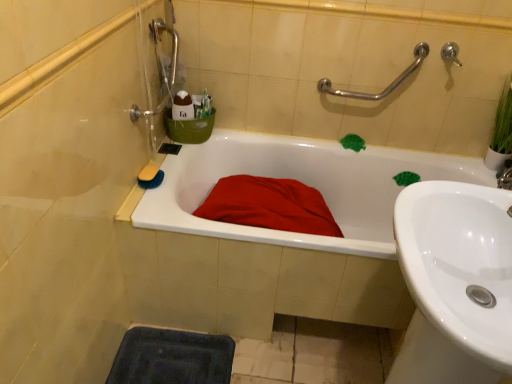
Question: Is yellow sponge at upper left outside dark blue rubber bath mat at lower left?

Choices:
 (A) yes
 (B) no

Answer: (A)

Question: Are yellow sponge at upper left and dark blue rubber bath mat at lower left making contact?

Choices:
 (A) yes
 (B) no

Answer: (B)

Question: Is yellow sponge at upper left not near dark blue rubber bath mat at lower left?

Choices:
 (A) yes
 (B) no

Answer: (B)

Question: Does yellow sponge at upper left have a smaller size compared to dark blue rubber bath mat at lower left?

Choices:
 (A) no
 (B) yes

Answer: (B)

Question: From a real-world perspective, is yellow sponge at upper left physically below dark blue rubber bath mat at lower left?

Choices:
 (A) yes
 (B) no

Answer: (B)

Question: Does yellow sponge at upper left have a greater width compared to dark blue rubber bath mat at lower left?

Choices:
 (A) no
 (B) yes

Answer: (A)

Question: Can dark blue rubber bath mat at lower left be found inside silver metallic faucet at upper right?

Choices:
 (A) no
 (B) yes

Answer: (A)

Question: From the image's perspective, is silver metallic faucet at upper right located beneath dark blue rubber bath mat at lower left?

Choices:
 (A) no
 (B) yes

Answer: (A)

Question: Is silver metallic faucet at upper right bigger than dark blue rubber bath mat at lower left?

Choices:
 (A) no
 (B) yes

Answer: (A)

Question: Is silver metallic faucet at upper right facing towards dark blue rubber bath mat at lower left?

Choices:
 (A) no
 (B) yes

Answer: (A)

Question: Is silver metallic faucet at upper right wider than dark blue rubber bath mat at lower left?

Choices:
 (A) yes
 (B) no

Answer: (B)

Question: Considering the relative positions of silver metallic faucet at upper right and dark blue rubber bath mat at lower left in the image provided, is silver metallic faucet at upper right in front of dark blue rubber bath mat at lower left?

Choices:
 (A) no
 (B) yes

Answer: (A)

Question: Does silver metallic faucet at upper right have a lesser width compared to white glossy bathtub at center?

Choices:
 (A) no
 (B) yes

Answer: (B)